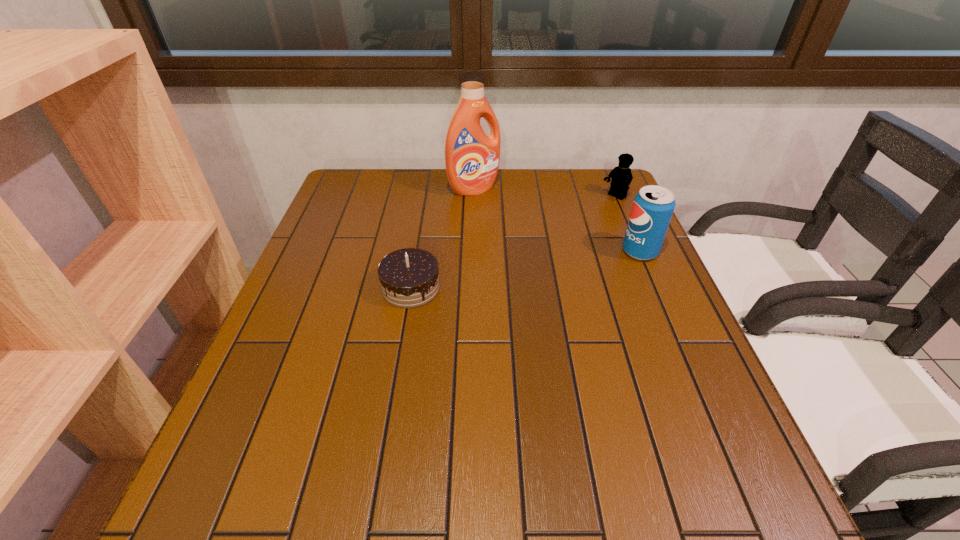
You are a GUI agent. You are given a task and a screenshot of the screen. Output one action in this format:
    pyautogui.click(x=<x>, y=<y>)
    Task: Click on the free space between the soda can and the Lego
    The image size is (960, 540).
    Given the screenshot: What is the action you would take?
    pyautogui.click(x=627, y=225)

Identify the location of free space between the soda can and the Lego. This screenshot has height=540, width=960. (627, 225).

Find the location of a particular element. blank region between the tallest object and the nearest object is located at coordinates (443, 238).

This screenshot has height=540, width=960. In order to click on vacant area between the chocolate cake and the second nearest object in this screenshot , I will do `click(525, 269)`.

The image size is (960, 540). What are the coordinates of `vacant region between the third shortest object and the second shortest object` in the screenshot? It's located at (627, 225).

The image size is (960, 540). In order to click on free space between the soda can and the Lego in this screenshot , I will do `click(627, 225)`.

Choose which object is the third nearest neighbor to the soda can. Please provide its 2D coordinates. Your answer should be formatted as a tuple, i.e. [(x, y)], where the tuple contains the x and y coordinates of a point satisfying the conditions above.

[(409, 278)]

Locate an element on the screen. Image resolution: width=960 pixels, height=540 pixels. object identified as the closest to the tallest object is located at coordinates (621, 176).

Locate an element on the screen. Image resolution: width=960 pixels, height=540 pixels. vacant region that satisfies the following two spatial constraints: 1. on the front side of the tallest object; 2. on the left side of the soda can is located at coordinates (472, 252).